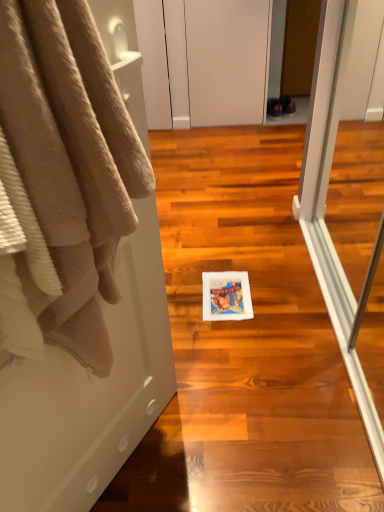
Question: Is white paper towel at center at the right side of white matte cabinet at upper center?

Choices:
 (A) yes
 (B) no

Answer: (A)

Question: Can you confirm if white paper towel at center is positioned to the left of white matte cabinet at upper center?

Choices:
 (A) yes
 (B) no

Answer: (B)

Question: Is white matte cabinet at upper center located within white paper towel at center?

Choices:
 (A) no
 (B) yes

Answer: (A)

Question: Is white paper towel at center facing towards white matte cabinet at upper center?

Choices:
 (A) no
 (B) yes

Answer: (A)

Question: Can you confirm if white paper towel at center is bigger than white matte cabinet at upper center?

Choices:
 (A) no
 (B) yes

Answer: (B)

Question: From a real-world perspective, is white paper towel at center over white matte cabinet at upper center?

Choices:
 (A) no
 (B) yes

Answer: (A)

Question: Can you confirm if beige plush towel at left is shorter than white paper towel at center?

Choices:
 (A) no
 (B) yes

Answer: (A)

Question: From a real-world perspective, is beige plush towel at left on top of white paper towel at center?

Choices:
 (A) no
 (B) yes

Answer: (B)

Question: Does beige plush towel at left come in front of white paper towel at center?

Choices:
 (A) yes
 (B) no

Answer: (A)

Question: Does beige plush towel at left appear on the left side of white paper towel at center?

Choices:
 (A) no
 (B) yes

Answer: (B)

Question: Is beige plush towel at left oriented away from white paper towel at center?

Choices:
 (A) yes
 (B) no

Answer: (B)

Question: Is beige plush towel at left wider than white paper towel at center?

Choices:
 (A) yes
 (B) no

Answer: (B)

Question: Could you tell me if beige plush towel at left is turned towards white matte cabinet at upper center?

Choices:
 (A) no
 (B) yes

Answer: (A)